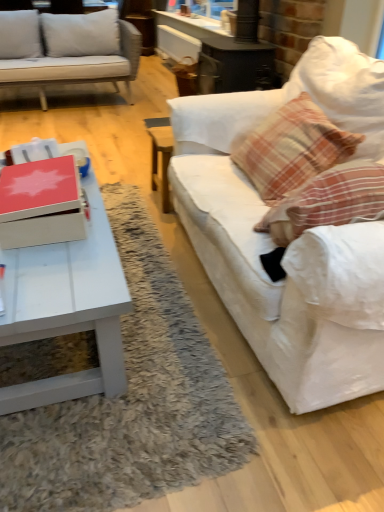
At what (x,y) coordinates should I click in order to perform the action: click on free space in front of matte red box at center. Please return your answer as a coordinate pair (x, y). The width and height of the screenshot is (384, 512). Looking at the image, I should click on (56, 271).